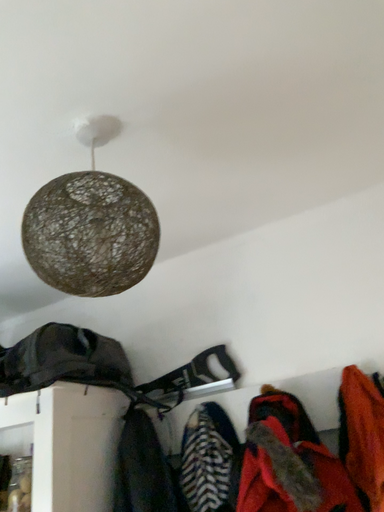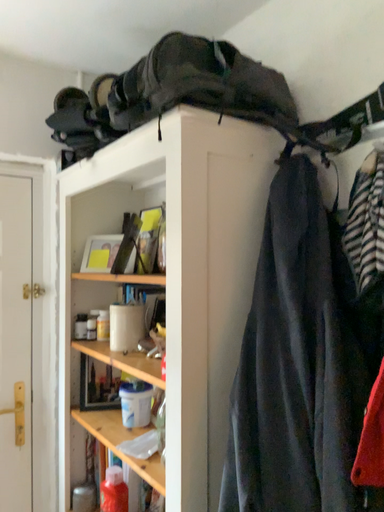
Question: Which way did the camera rotate in the video?

Choices:
 (A) rotated left
 (B) rotated right

Answer: (A)